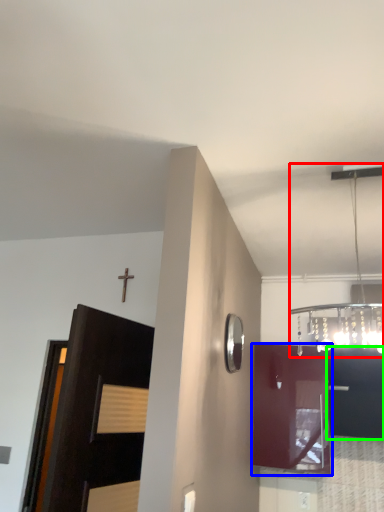
Question: Estimate the real-world distances between objects in this image. Which object is closer to light fixture (highlighted by a red box), cabinetry (highlighted by a blue box) or cabinetry (highlighted by a green box)?

Choices:
 (A) cabinetry
 (B) cabinetry

Answer: (B)